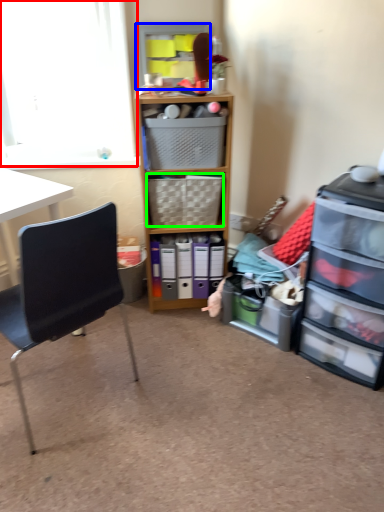
Question: Based on their relative distances, which object is farther from window screen (highlighted by a red box)? Choose from shelf (highlighted by a blue box) and picnic basket (highlighted by a green box).

Choices:
 (A) shelf
 (B) picnic basket

Answer: (B)